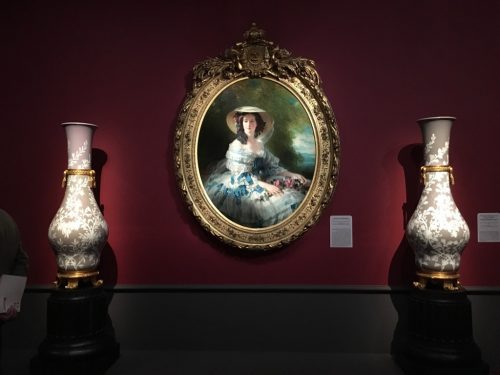
Locate an element on the screen. red wall is located at coordinates (144, 211).